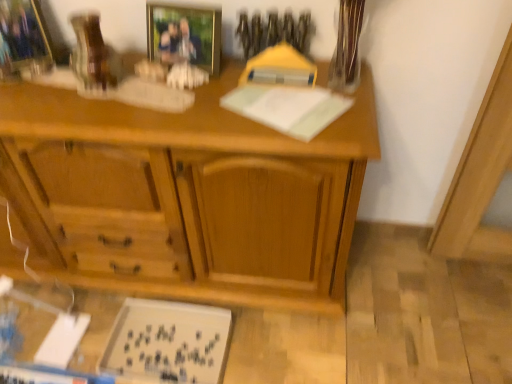
Question: Considering the relative positions of gold-framed photo at upper center, which is counted as the first picture frame, starting from the right, and brushed metal picture frame at upper left, placed as the first picture frame when sorted from left to right, in the image provided, is gold-framed photo at upper center, which is counted as the first picture frame, starting from the right, to the left or to the right of brushed metal picture frame at upper left, placed as the first picture frame when sorted from left to right,?

Choices:
 (A) left
 (B) right

Answer: (B)

Question: Looking at their shapes, would you say gold-framed photo at upper center, which is counted as the first picture frame, starting from the right, is wider or thinner than brushed metal picture frame at upper left, placed as the first picture frame when sorted from left to right?

Choices:
 (A) thin
 (B) wide

Answer: (A)

Question: Which object is positioned closest to the wooden desk at center?

Choices:
 (A) white matte board at lower left
 (B) gold-framed photo at upper center, which is counted as the first picture frame, starting from the right
 (C) brushed metal picture frame at upper left, which ranks as the 2th picture frame in right-to-left order
 (D) clear glass vase at upper right

Answer: (A)

Question: Which object is positioned closest to the clear glass vase at upper right?

Choices:
 (A) wooden desk at center
 (B) brushed metal picture frame at upper left, placed as the first picture frame when sorted from left to right
 (C) white matte board at lower left
 (D) gold-framed photo at upper center, which is counted as the first picture frame, starting from the right

Answer: (D)